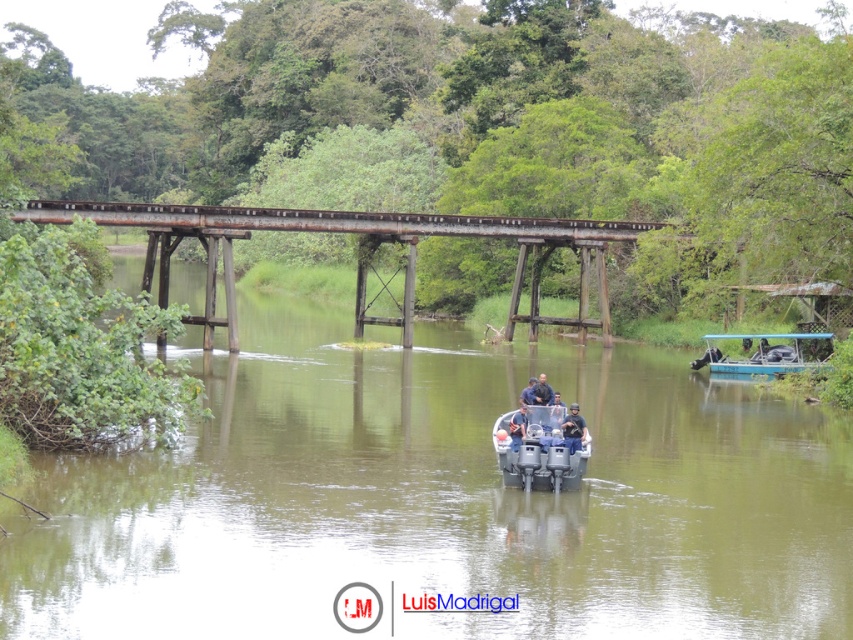
Which of these two, dark blue uniform at center or black matte helmet at center, stands shorter?

dark blue uniform at center is shorter.

Is point (577, 406) behind point (552, 403)?

That is False.

Is point (570, 422) less distant than point (556, 401)?

That is True.

Image resolution: width=853 pixels, height=640 pixels. Identify the location of dark blue uniform at center. (573, 428).

Does black matte helmet at center appear on the right side of dark blue fabric at center?

Indeed, black matte helmet at center is positioned on the right side of dark blue fabric at center.

Describe the element at coordinates (555, 410) in the screenshot. I see `black matte helmet at center` at that location.

This screenshot has height=640, width=853. I want to click on black matte helmet at center, so click(555, 410).

Does blue plastic boat at right come behind dark blue shirt at center?

Yes, blue plastic boat at right is behind dark blue shirt at center.

Where is `blue plastic boat at right`? This screenshot has height=640, width=853. blue plastic boat at right is located at coordinates (767, 355).

You are a GUI agent. You are given a task and a screenshot of the screen. Output one action in this format:
    pyautogui.click(x=<x>, y=<y>)
    Task: Click on the blue plastic boat at right
    The height and width of the screenshot is (640, 853).
    Given the screenshot: What is the action you would take?
    pyautogui.click(x=767, y=355)